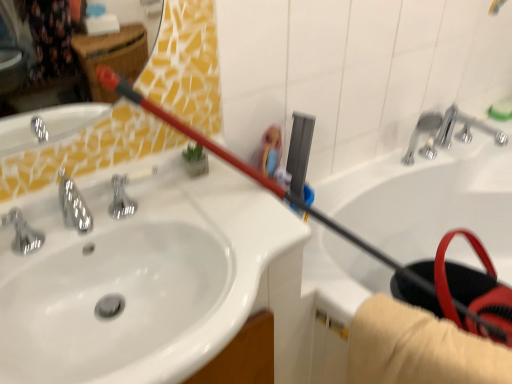
Question: From a real-world perspective, is silver metallic faucet at upper right, the second plumbing fixture from the left, positioned above or below silver metallic faucet at left?

Choices:
 (A) above
 (B) below

Answer: (B)

Question: Is silver metallic faucet at upper right, the first plumbing fixture from the right, wider or thinner than silver metallic faucet at left?

Choices:
 (A) wide
 (B) thin

Answer: (A)

Question: Which object is positioned farthest from the white glossy bathtub at upper right?

Choices:
 (A) silver metallic faucet at left
 (B) white glossy sink at upper left
 (C) chrome metallic faucet at upper right, the first plumbing fixture in the left-to-right sequence
 (D) silver metallic faucet at upper right, the second plumbing fixture from the left

Answer: (A)

Question: Considering the real-world distances, which object is closest to the white glossy bathtub at upper right?

Choices:
 (A) white glossy sink at upper left
 (B) silver metallic faucet at left
 (C) silver metallic faucet at upper right, the first plumbing fixture from the right
 (D) chrome metallic faucet at upper right, marked as the second plumbing fixture in a right-to-left arrangement

Answer: (C)